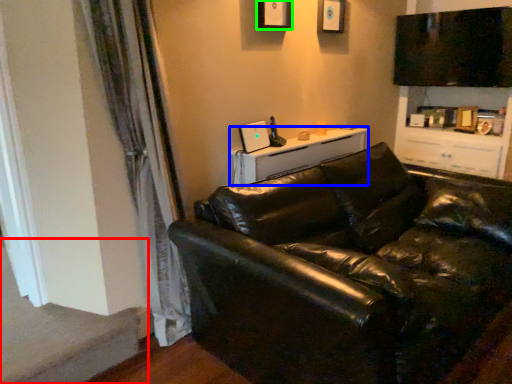
Question: Considering the real-world distances, which object is farthest from stairwell (highlighted by a red box)? table (highlighted by a blue box) or picture frame (highlighted by a green box)?

Choices:
 (A) table
 (B) picture frame

Answer: (B)